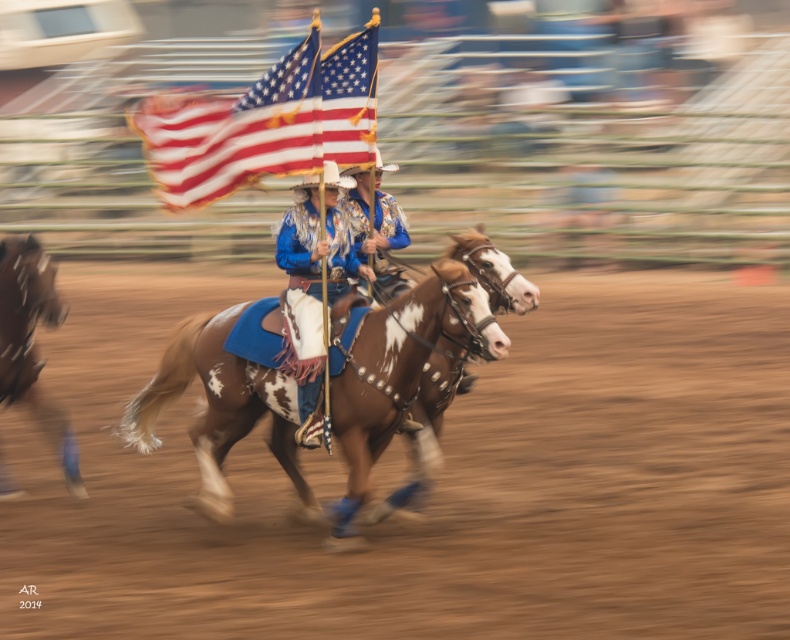
Looking at this image, you are a photographer at the rodeo event. You need to capture a photo where the american flag at center is clearly visible above the brown speckled horse at left. Based on the scene description, will the flag be visible in this position?

Yes, the american flag at center is above the brown speckled horse at left, so it will be clearly visible in the photo.

You are a photographer at the rodeo and want to capture both the brown speckled horse at center and the brown speckled horse at left in a single photo. Given that your camera has a minimum focus distance of 1 meter, will you be able to take the photo without moving closer?

The distance between the brown speckled horse at center and the brown speckled horse at left is 1.26 meters. Since the minimum focus distance is 1 meter, the camera can capture both horses in a single photo without moving closer.